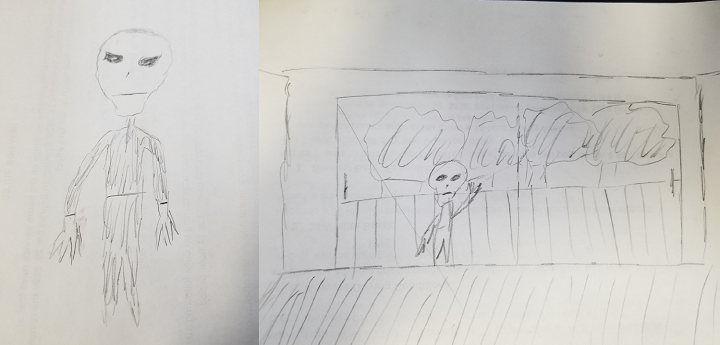
I want to click on floor, so click(558, 306).